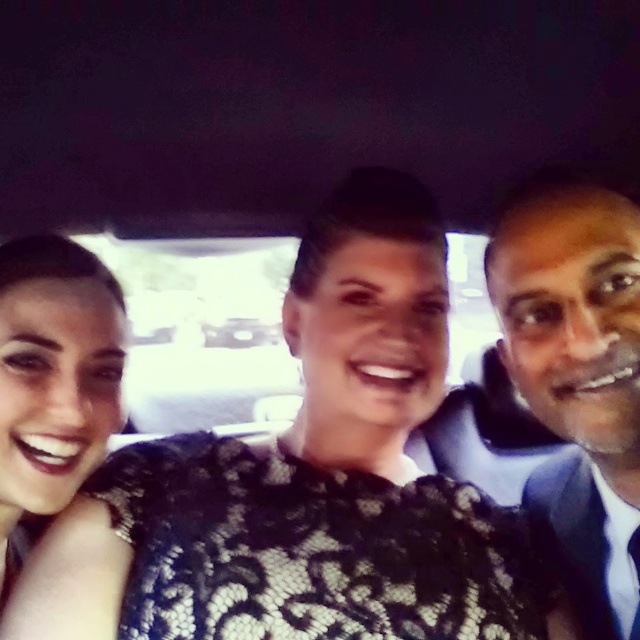
You are sitting in the backseat of a car and notice two points marked on the window. The first point is at coordinate point (428,477) and the second point is at coordinate point (593,449). From your perspective inside the car, which point is closer to you?

Point (593,449) is closer to you because it is in front of point (428,477) according to the spatial relationship provided.

Based on the photo, you are designing a new car seat that needs to accommodate passengers wearing different types of dresses. The black lace dress at center and the matte black dress at left are both present in the scene. Based on the image, which dress requires more horizontal space due to its width?

The black lace dress at center requires more horizontal space because its width is larger than the matte black dress at left.

You are a photographer trying to capture a closeup of the black lace dress at center. You have a camera with a focal length of 50mm. The point at coordinates point (307, 481) is on the black lace dress at center. Based on this information, can you determine if the focal length is suitable for capturing the dress in focus?

The point at coordinates point (307, 481) is on the black lace dress at center, so the focal length of 50mm is suitable for capturing the dress in focus.